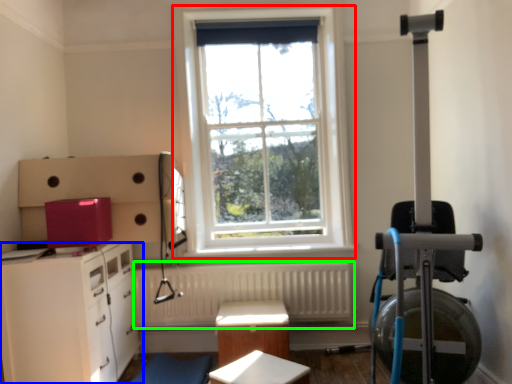
Question: Based on their relative distances, which object is farther from window (highlighted by a red box)? Choose from chest of drawers (highlighted by a blue box) and radiator (highlighted by a green box).

Choices:
 (A) chest of drawers
 (B) radiator

Answer: (A)